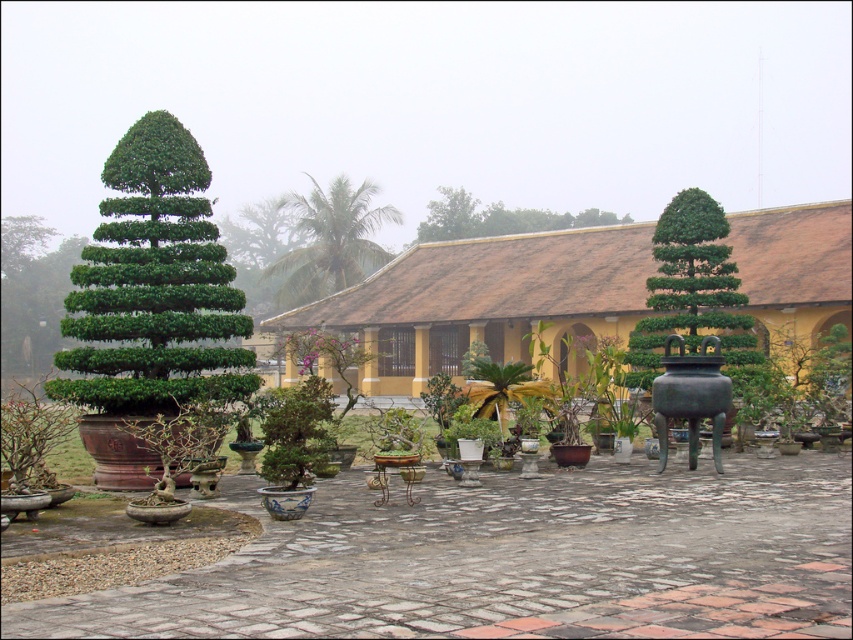
Who is shorter, green leafy tree at left or green leafy palm at center?

With less height is green leafy tree at left.

Who is taller, green leafy tree at left or green leafy palm at center?

green leafy palm at center

At what (x,y) coordinates should I click in order to perform the action: click on green leafy tree at left. Please return your answer as a coordinate pair (x, y). The height and width of the screenshot is (640, 853). Looking at the image, I should click on (154, 285).

Image resolution: width=853 pixels, height=640 pixels. I want to click on green leafy tree at left, so click(154, 285).

Who is more forward, (x=680, y=218) or (x=305, y=227)?

Point (x=680, y=218) is more forward.

Is green glossy bonsai at right thinner than green leafy palm at center?

Yes.

Who is more distant from viewer, (688, 253) or (326, 275)?

Positioned behind is point (326, 275).

This screenshot has height=640, width=853. In order to click on green glossy bonsai at right in this screenshot , I will do click(692, 291).

Is point (292, 192) closer to camera compared to point (548, 218)?

No.

At what (x,y) coordinates should I click in order to perform the action: click on green leafy palm at center. Please return your answer as a coordinate pair (x, y). This screenshot has height=640, width=853. Looking at the image, I should click on 329,240.